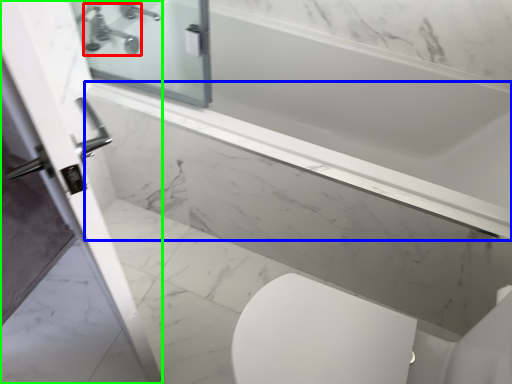
Question: Which object is the closest to the tap (highlighted by a red box)? Choose among these: ledge (highlighted by a blue box) or screen door (highlighted by a green box).

Choices:
 (A) ledge
 (B) screen door

Answer: (A)